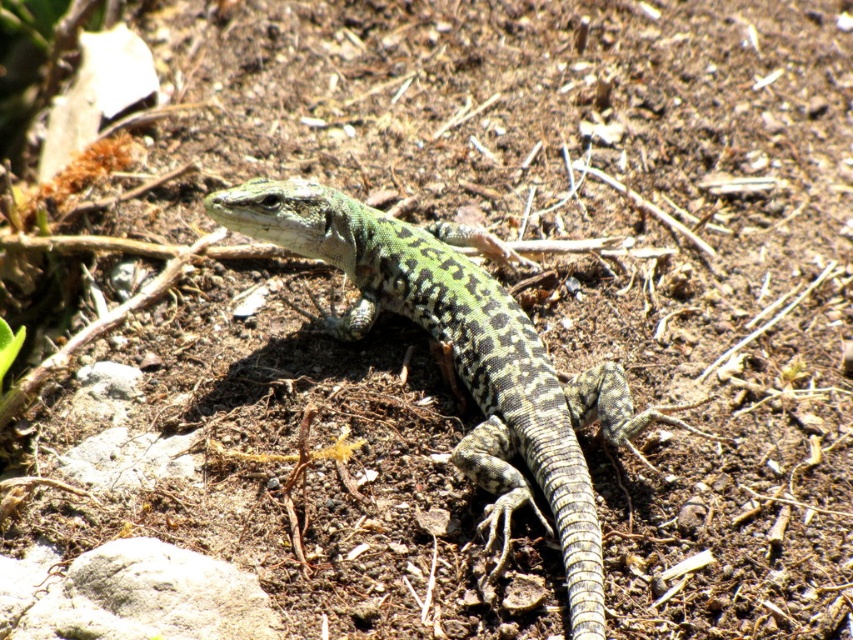
How distant is green scaly lizard at center from gray rough rock at lower left?

A distance of 22.15 inches exists between green scaly lizard at center and gray rough rock at lower left.

Which is above, green scaly lizard at center or gray rough rock at lower left?

green scaly lizard at center is above.

Between point (544, 381) and point (62, 582), which one is positioned behind?

Positioned behind is point (544, 381).

In order to click on green scaly lizard at center in this screenshot , I will do `click(463, 356)`.